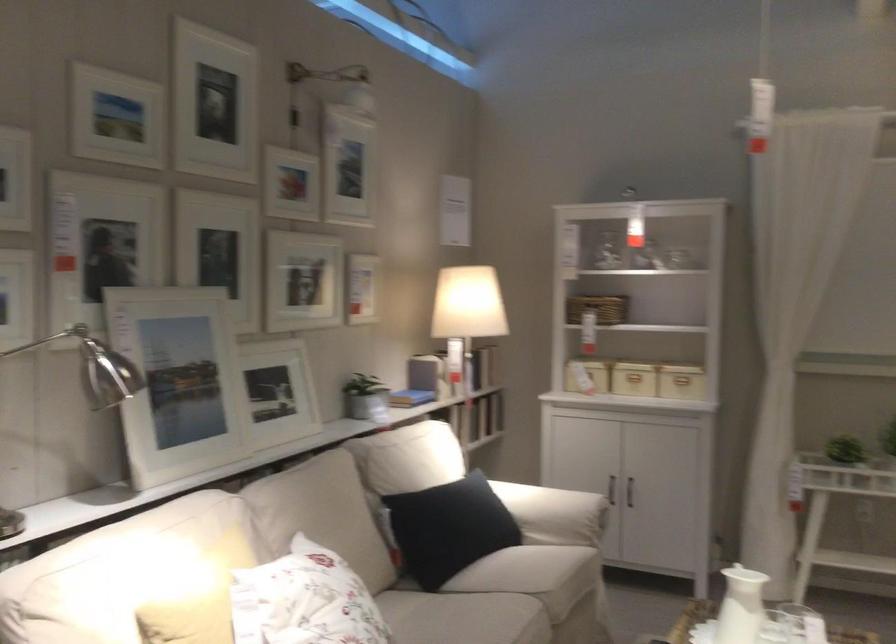
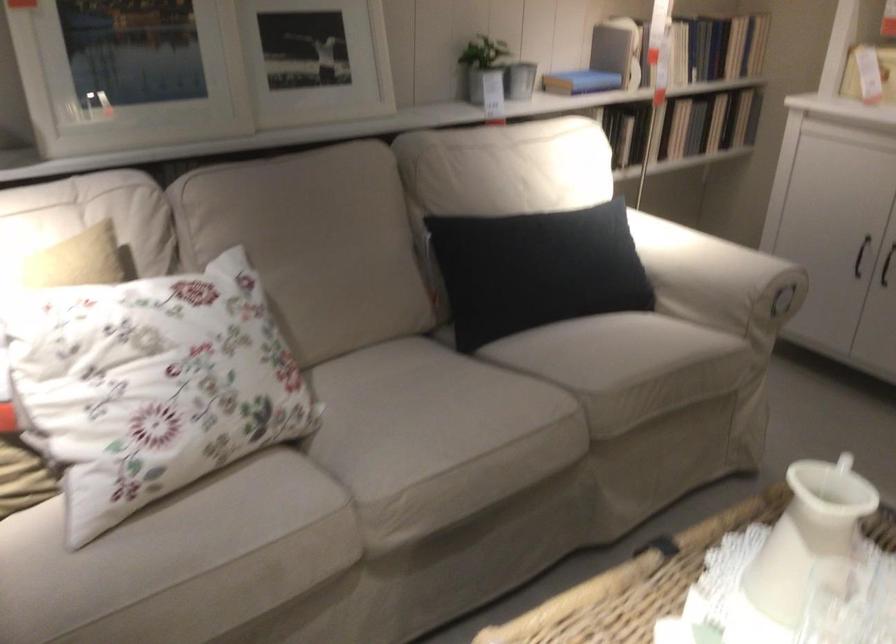
Find the pixel in the second image that matches pixel 567 514 in the first image.

(717, 279)